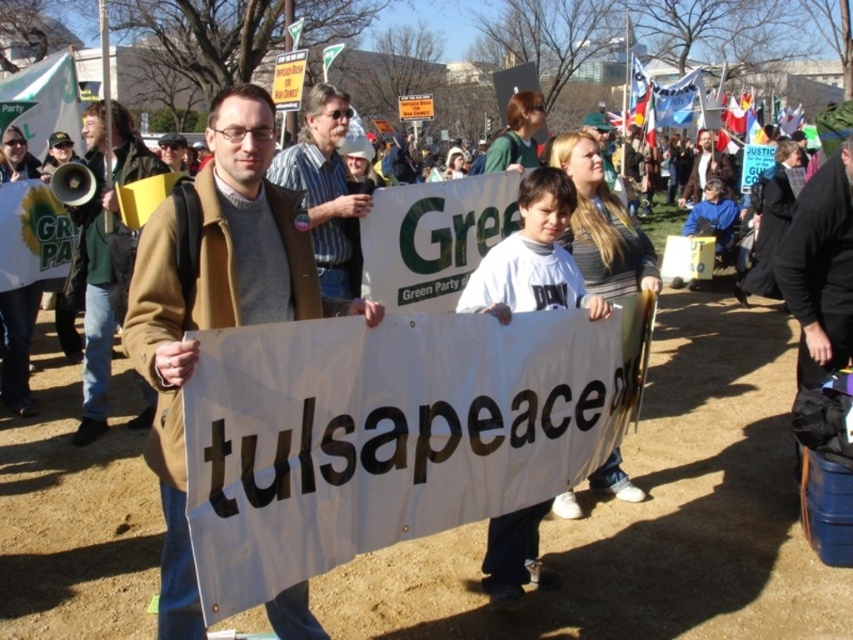
You are a photographer at the protest scene. You want to take a photo that includes both the brown leather jacket at center and the black fabric bag at right. Given their sizes, which object should you focus on to ensure both are in frame without cropping?

The brown leather jacket at center is much taller than the black fabric bag at right, so focusing on the taller object, the brown leather jacket at center, will ensure both are in frame without cropping.

What are the coordinates of the brown wool coat at center?

The brown wool coat at center is located at point (x=213, y=301).

You are a photographer standing at the edge of the protest. You want to take a photo that includes both the brown wool coat at center and the black fabric bag at right. What is the minimum distance you need to move backward to ensure both objects are in frame?

The minimum distance you need to move backward is 2.81 meters to include both the brown wool coat at center and the black fabric bag at right in the photo.